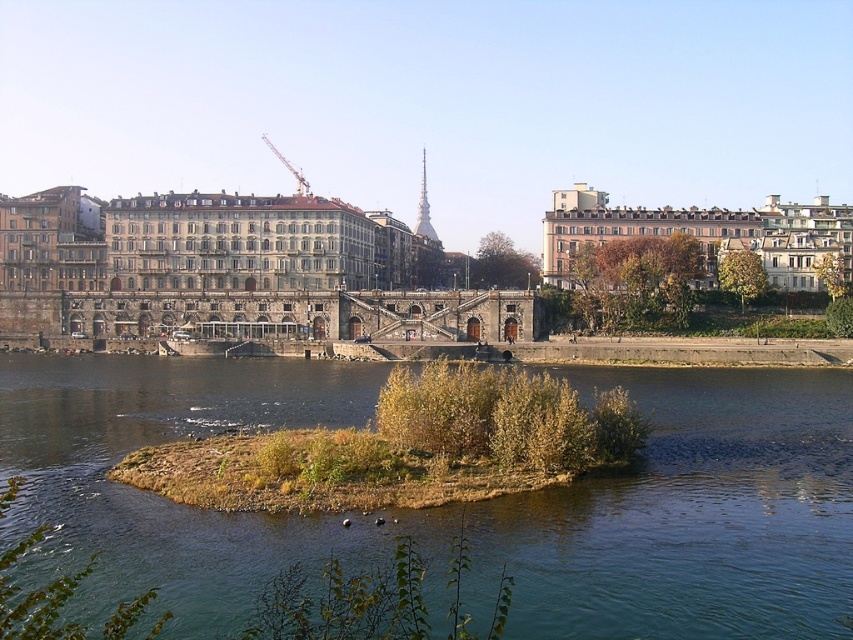
Question: Is greenish-blue water at center thinner than metallic gray crane at upper center?

Choices:
 (A) yes
 (B) no

Answer: (B)

Question: Which object is closer to the camera taking this photo?

Choices:
 (A) metallic gray crane at upper center
 (B) greenish-blue water at center

Answer: (B)

Question: Which of the following is the farthest from the observer?

Choices:
 (A) metallic gray crane at upper center
 (B) greenish-blue water at center

Answer: (A)

Question: Which point is closer to the camera taking this photo?

Choices:
 (A) (10, 388)
 (B) (303, 182)

Answer: (A)

Question: Is greenish-blue water at center positioned before metallic gray crane at upper center?

Choices:
 (A) yes
 (B) no

Answer: (A)

Question: Observing the image, what is the correct spatial positioning of greenish-blue water at center in reference to metallic gray crane at upper center?

Choices:
 (A) above
 (B) below

Answer: (B)